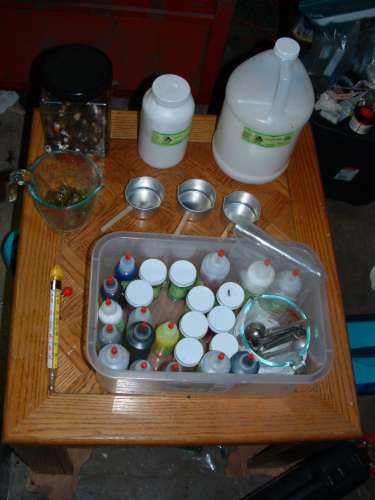
At what (x,y) coordinates should I click in order to perform the action: click on cardboard under table's legs. Please return your answer as a coordinate pair (x, y). Looking at the image, I should click on (53, 481), (239, 466).